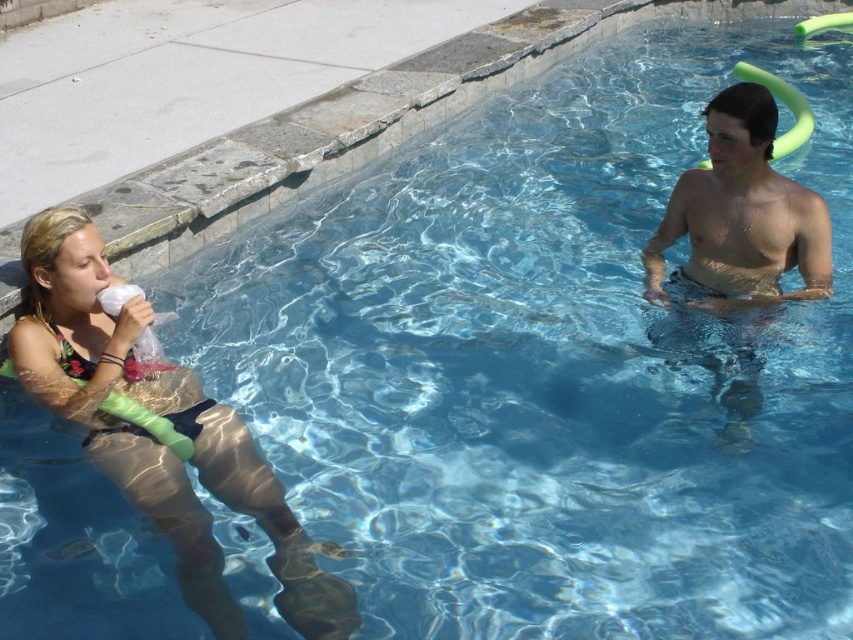
Question: Which of the following is the closest to the observer?

Choices:
 (A) [54, 273]
 (B) [756, 115]

Answer: (A)

Question: Which point appears closest to the camera in this image?

Choices:
 (A) (718, 195)
 (B) (38, 260)

Answer: (B)

Question: Is matte green float at left smaller than shiny brown skin at upper right?

Choices:
 (A) yes
 (B) no

Answer: (B)

Question: Which point is farther to the camera?

Choices:
 (A) shiny brown skin at upper right
 (B) matte green float at left

Answer: (A)

Question: Is the position of matte green float at left less distant than that of shiny brown skin at upper right?

Choices:
 (A) yes
 (B) no

Answer: (A)

Question: Is matte green float at left wider than shiny brown skin at upper right?

Choices:
 (A) yes
 (B) no

Answer: (A)